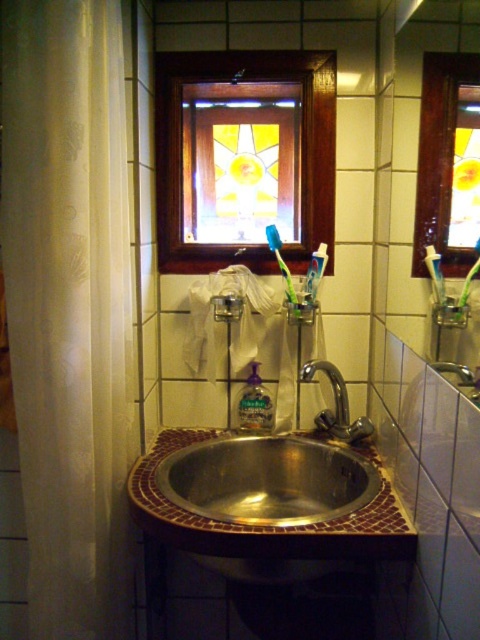
Does white sheer curtain at left appear over translucent plastic soap dispenser at center?

Indeed, white sheer curtain at left is positioned over translucent plastic soap dispenser at center.

What do you see at coordinates (69, 307) in the screenshot? The image size is (480, 640). I see `white sheer curtain at left` at bounding box center [69, 307].

Find the location of a particular element. white sheer curtain at left is located at coordinates (69, 307).

Image resolution: width=480 pixels, height=640 pixels. What do you see at coordinates (267, 480) in the screenshot?
I see `stainless steel sink at center` at bounding box center [267, 480].

Does stainless steel sink at center come in front of white matte toothpaste at center?

Yes, stainless steel sink at center is closer to the viewer.

Find the location of a particular element. stainless steel sink at center is located at coordinates (267, 480).

This screenshot has height=640, width=480. I want to click on stainless steel sink at center, so tap(267, 480).

Can you confirm if chrome metallic faucet at center is positioned to the right of white matte toothpaste at center?

Indeed, chrome metallic faucet at center is positioned on the right side of white matte toothpaste at center.

Can you confirm if chrome metallic faucet at center is shorter than white matte toothpaste at center?

No.

The width and height of the screenshot is (480, 640). What are the coordinates of `chrome metallic faucet at center` in the screenshot? It's located at (336, 404).